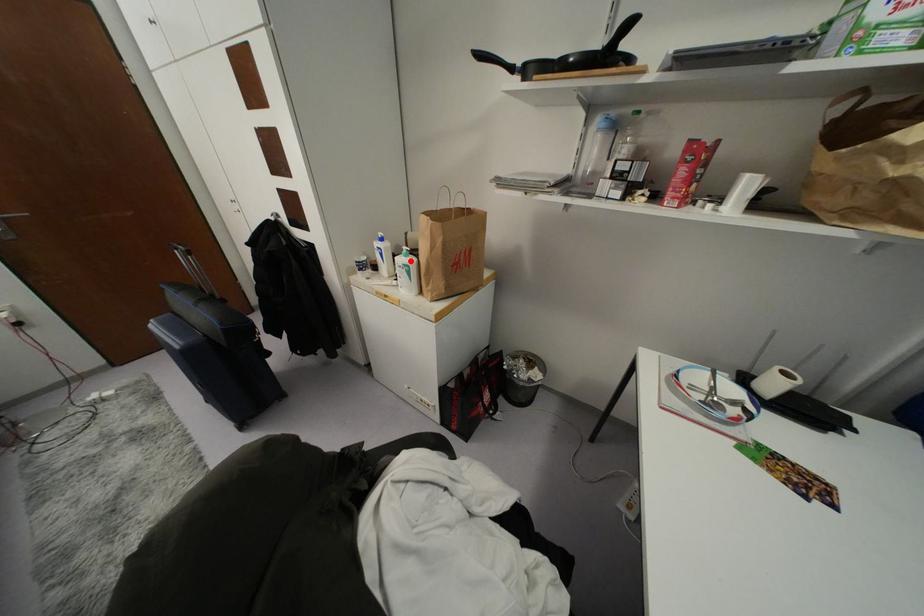
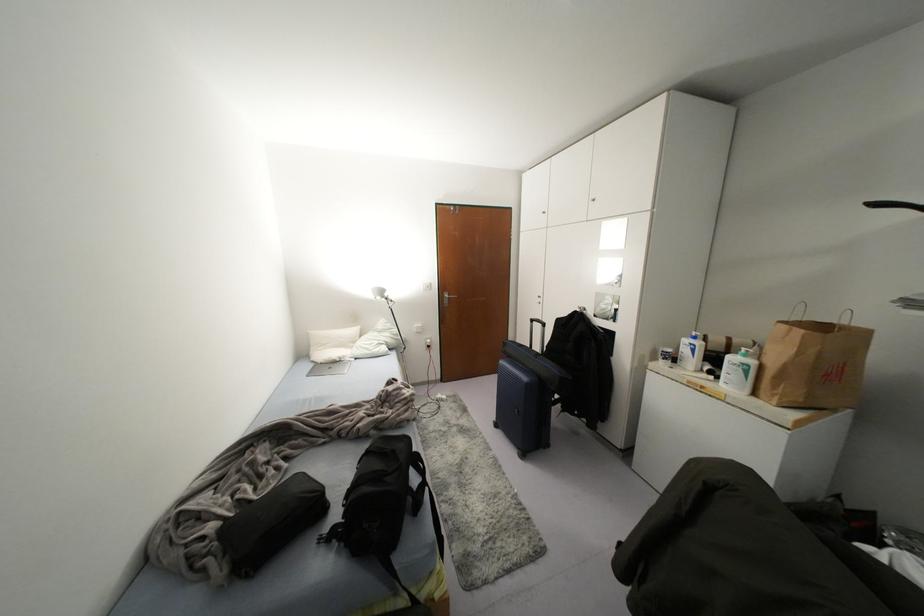
Where in the second image is the point corresponding to the highlighted location from the first image?

(751, 362)